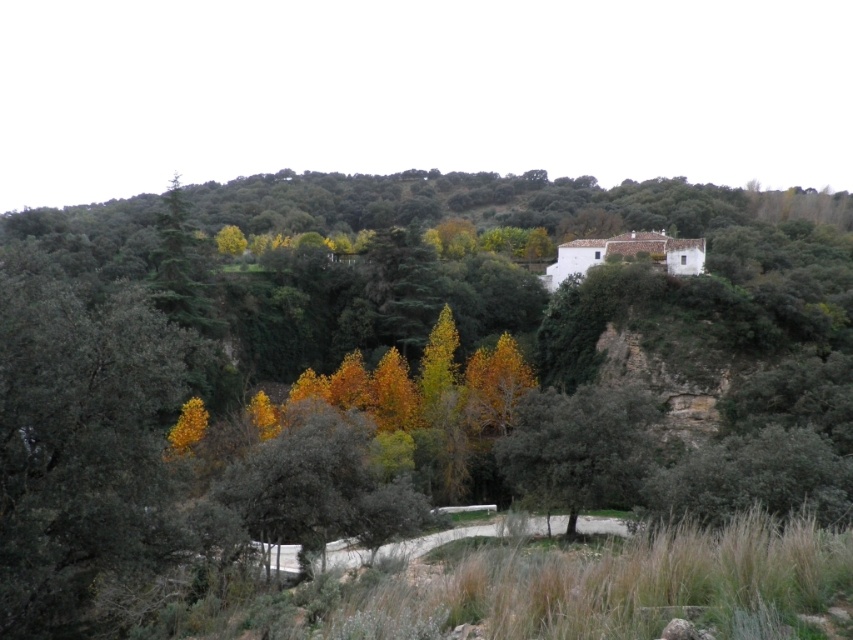
You are standing at the base of the hill in the midground and want to reach the point marked by point [16,252] and point [621,452]. Which point is closer to you?

Point [16,252] is closer to you because it is further to the viewer than point [621,452].